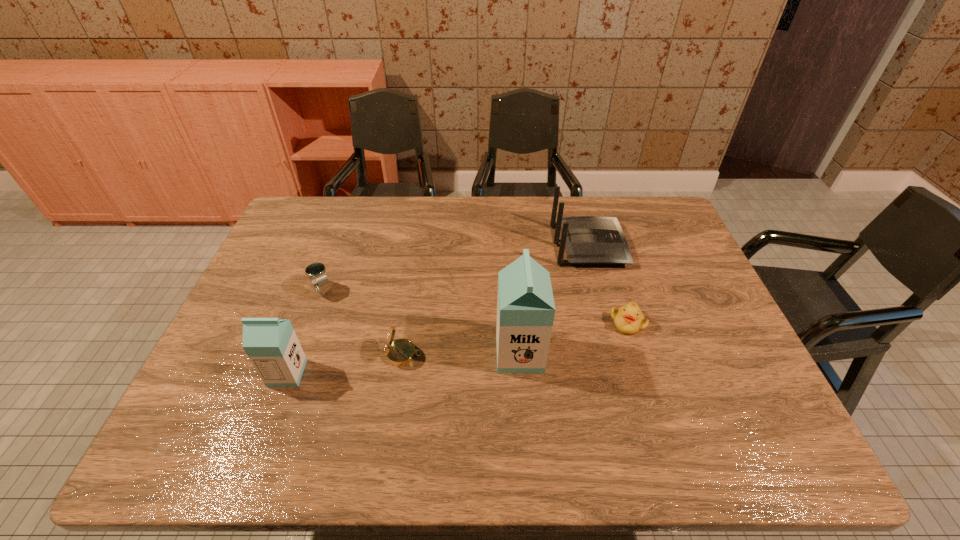
You are a GUI agent. You are given a task and a screenshot of the screen. Output one action in this format:
    pyautogui.click(x=<x>, y=<y>)
    Task: Click on the fifth shortest object
    
    Given the screenshot: What is the action you would take?
    pyautogui.click(x=272, y=346)

Locate an element on the screen. the left milk carton is located at coordinates 272,346.

What are the coordinates of `the right milk carton` in the screenshot? It's located at (525, 306).

In order to click on the tallest object in this screenshot , I will do `click(525, 306)`.

The width and height of the screenshot is (960, 540). Find the location of `router`. router is located at coordinates (589, 240).

Identify the location of the farthest object. The image size is (960, 540). (589, 240).

The height and width of the screenshot is (540, 960). What are the coordinates of `the fourth object from right to left` in the screenshot? It's located at (400, 352).

Where is `the fifth nearest object`? the fifth nearest object is located at coordinates (316, 271).

Find the location of `duckling`. duckling is located at coordinates (628, 319).

Image resolution: width=960 pixels, height=540 pixels. Identify the location of free space located 0.270m on the right of the left milk carton. (413, 373).